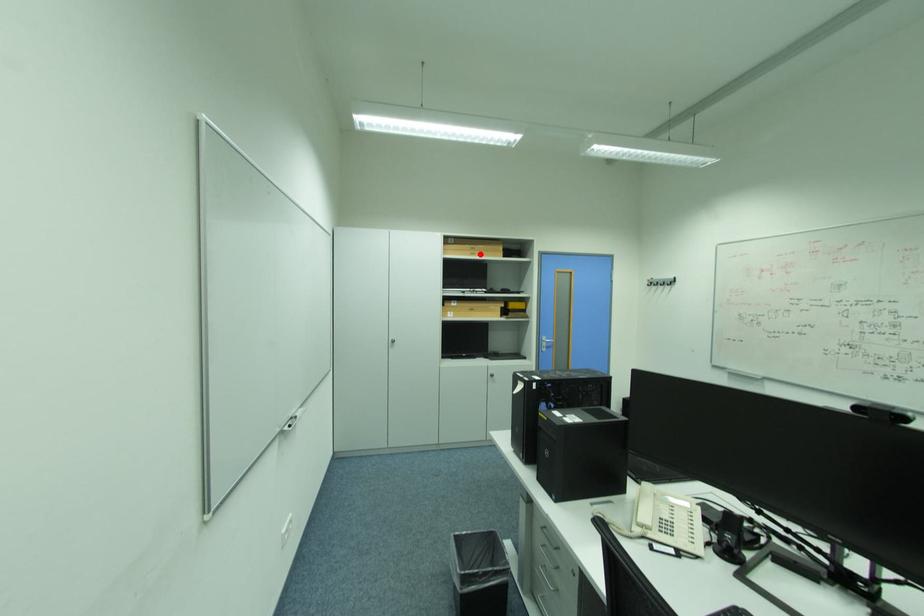
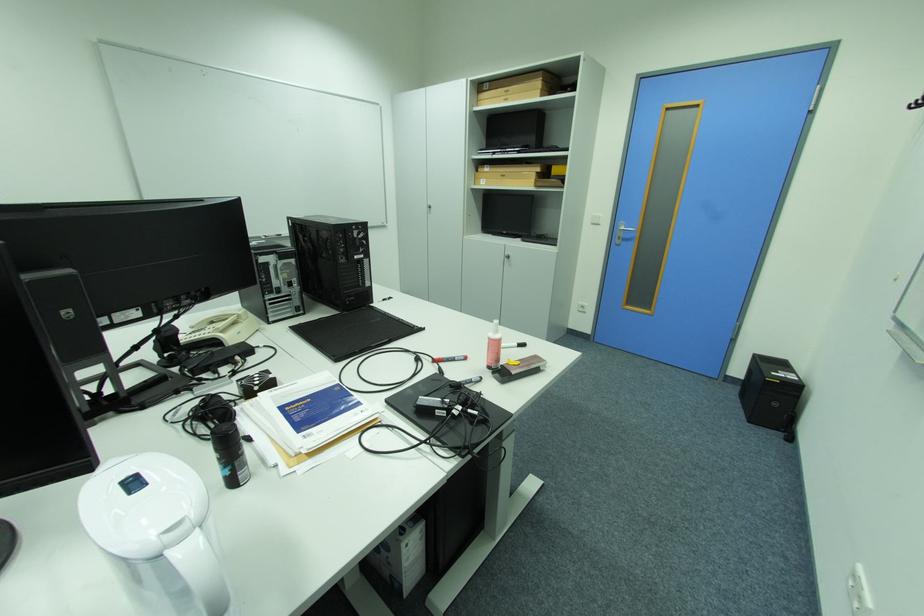
The point at the highlighted location is marked in the first image. Where is the corresponding point in the second image?

(514, 100)